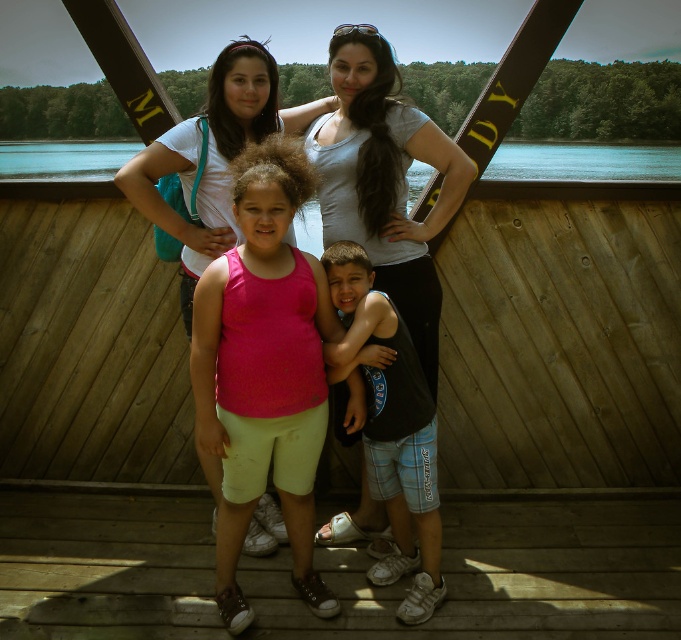
Question: Is black cotton tank top at center to the right of matte white tank top at center from the viewer's perspective?

Choices:
 (A) no
 (B) yes

Answer: (B)

Question: Which point is farther from the camera taking this photo?

Choices:
 (A) (330, 536)
 (B) (257, 276)
 (C) (67, 141)
 (D) (411, 483)

Answer: (C)

Question: Observing the image, what is the correct spatial positioning of pink fabric tank top at center in reference to black cotton tank top at center?

Choices:
 (A) above
 (B) below

Answer: (A)

Question: Can you confirm if brown wooden deck at center is positioned above pink fabric tank top at center?

Choices:
 (A) yes
 (B) no

Answer: (B)

Question: Which point appears farthest from the camera in this image?

Choices:
 (A) (584, 500)
 (B) (411, 364)

Answer: (A)

Question: Among these objects, which one is farthest from the camera?

Choices:
 (A) brown wooden deck at center
 (B) black cotton tank top at center

Answer: (B)